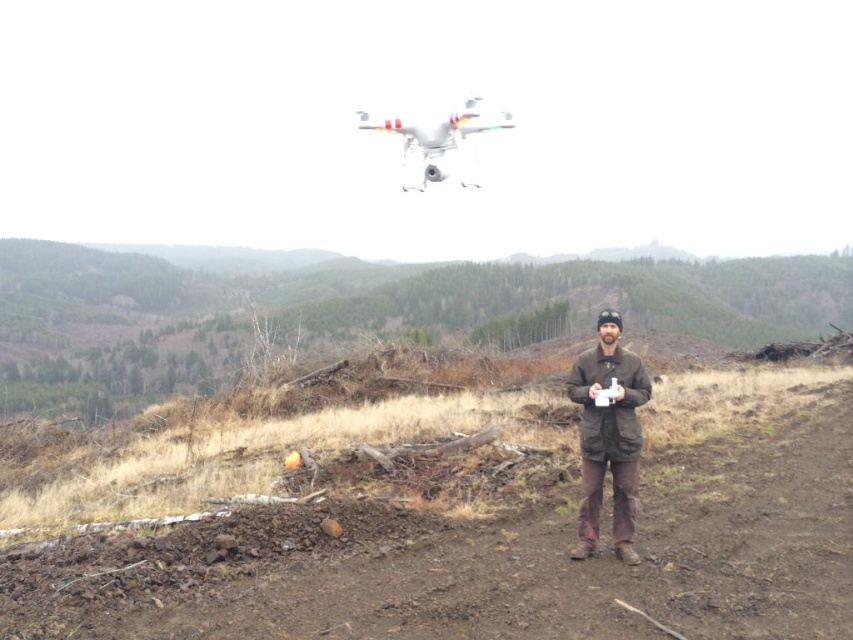
Question: Which of these objects is positioned farthest from the brown soil at center?

Choices:
 (A) white matte drone at upper center
 (B) brown woolen jacket at center

Answer: (A)

Question: Is brown soil at center positioned behind white matte drone at upper center?

Choices:
 (A) no
 (B) yes

Answer: (A)

Question: From the image, what is the correct spatial relationship of brown woolen jacket at center in relation to white matte drone at upper center?

Choices:
 (A) right
 (B) left

Answer: (A)

Question: Does brown soil at center appear on the left side of brown woolen jacket at center?

Choices:
 (A) yes
 (B) no

Answer: (B)

Question: Which is farther from the brown soil at center?

Choices:
 (A) brown woolen jacket at center
 (B) white matte drone at upper center

Answer: (B)

Question: Which object appears closest to the camera in this image?

Choices:
 (A) brown woolen jacket at center
 (B) brown soil at center

Answer: (B)